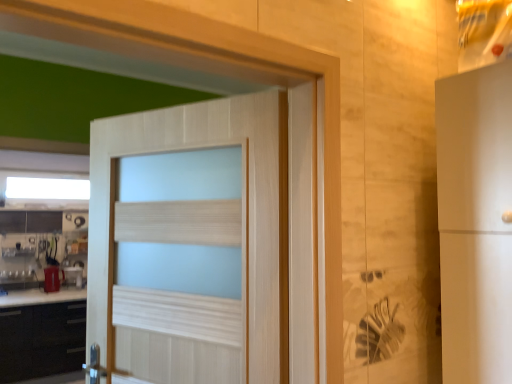
Question: Is metallic silver kettle at left, which is the second appliance in back-to-front order, next to black matte cabinet at lower left?

Choices:
 (A) no
 (B) yes

Answer: (A)

Question: Is black matte cabinet at lower left a part of metallic silver kettle at left, which is the second appliance in back-to-front order?

Choices:
 (A) no
 (B) yes

Answer: (A)

Question: Is metallic silver kettle at left, which is the second appliance in back-to-front order, shorter than black matte cabinet at lower left?

Choices:
 (A) yes
 (B) no

Answer: (A)

Question: Is metallic silver kettle at left, the first appliance from the front, not inside black matte cabinet at lower left?

Choices:
 (A) yes
 (B) no

Answer: (A)

Question: Is metallic silver kettle at left, which is the second appliance in back-to-front order, behind black matte cabinet at lower left?

Choices:
 (A) yes
 (B) no

Answer: (A)

Question: Looking at the image, does matte red cup at lower left, which ranks as the 2th appliance in front-to-back order, seem bigger or smaller compared to light wood door at center?

Choices:
 (A) big
 (B) small

Answer: (B)

Question: Relative to light wood door at center, is matte red cup at lower left, which ranks as the 2th appliance in front-to-back order, in front or behind?

Choices:
 (A) behind
 (B) front

Answer: (A)

Question: From their relative heights in the image, would you say matte red cup at lower left, which is counted as the first appliance, starting from the back, is taller or shorter than light wood door at center?

Choices:
 (A) tall
 (B) short

Answer: (B)

Question: Which is correct: matte red cup at lower left, which ranks as the 2th appliance in front-to-back order, is inside light wood door at center, or outside of it?

Choices:
 (A) outside
 (B) inside

Answer: (A)

Question: Is light wood door at center inside or outside of black matte cabinet at lower left?

Choices:
 (A) inside
 (B) outside

Answer: (B)

Question: From the image's perspective, is light wood door at center above or below black matte cabinet at lower left?

Choices:
 (A) above
 (B) below

Answer: (A)

Question: Would you say light wood door at center is to the left or to the right of black matte cabinet at lower left in the picture?

Choices:
 (A) left
 (B) right

Answer: (B)

Question: Looking at the image, does light wood door at center seem bigger or smaller compared to black matte cabinet at lower left?

Choices:
 (A) small
 (B) big

Answer: (A)

Question: In terms of height, does black matte cabinet at lower left look taller or shorter compared to white frosted glass window at upper center?

Choices:
 (A) short
 (B) tall

Answer: (B)

Question: In terms of width, does black matte cabinet at lower left look wider or thinner when compared to white frosted glass window at upper center?

Choices:
 (A) wide
 (B) thin

Answer: (A)